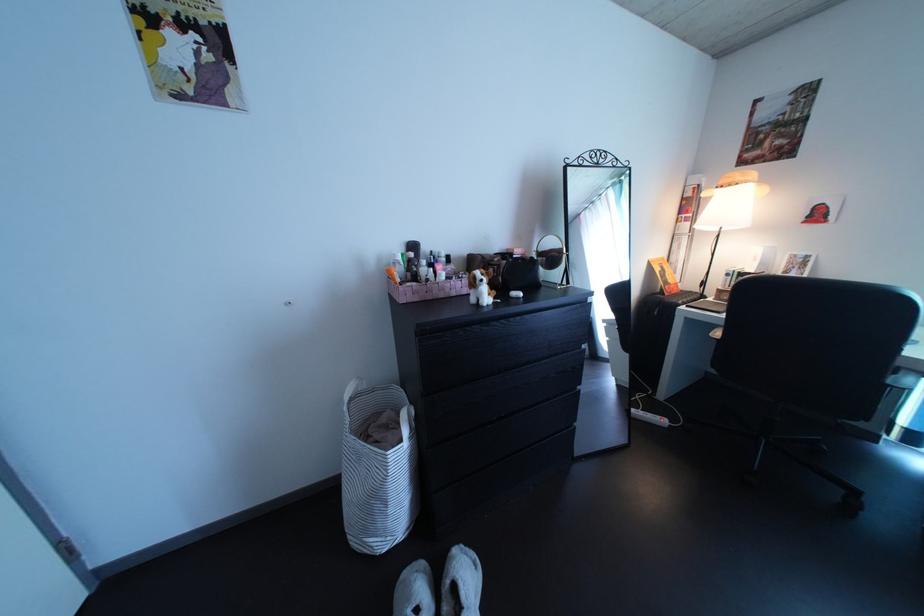
Find where to lift the laundry basket handle. Please return your answer as a coordinate pair (x, y).

(406, 421)